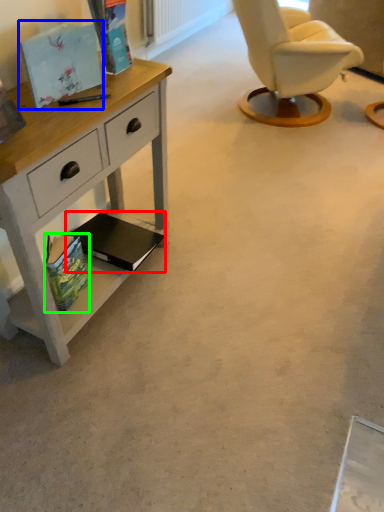
Question: Which object is positioned closest to magazine (highlighted by a red box)? Select from magazine (highlighted by a blue box) and magazine (highlighted by a green box).

Choices:
 (A) magazine
 (B) magazine

Answer: (B)